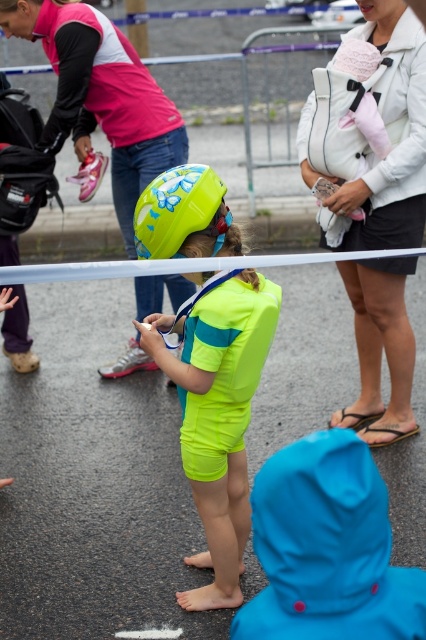
You are a photographer at the event and want to capture a photo that includes both the neon yellow swimsuit at center and the pink fabric jacket at upper left. Which object should you focus on first to ensure both are in the frame?

You should focus on the neon yellow swimsuit at center first since it is in front of the pink fabric jacket at upper left, ensuring both are visible in the photo.

You are a photographer trying to capture the neon yellow swimsuit at center and the pink fabric jacket at upper left in the same frame. Based on their positions, which one would appear closer to the bottom of the photo?

The neon yellow swimsuit at center appears closer to the bottom of the photo because it is positioned below the pink fabric jacket at upper left.